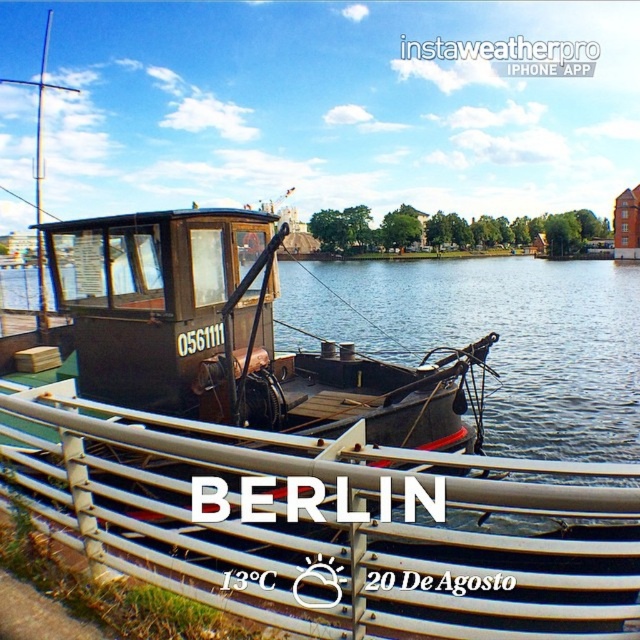
Question: Among these objects, which one is nearest to the camera?

Choices:
 (A) metal/rustic rail at lower center
 (B) rusty metal boat at center

Answer: (A)

Question: Which point appears closest to the camera in this image?

Choices:
 (A) (60, 396)
 (B) (120, 372)

Answer: (A)

Question: Is metal/rustic rail at lower center further to the viewer compared to rusty metal boat at center?

Choices:
 (A) yes
 (B) no

Answer: (B)

Question: From the image, what is the correct spatial relationship of metal/rustic rail at lower center in relation to rusty metal boat at center?

Choices:
 (A) left
 (B) right

Answer: (A)

Question: Can you confirm if metal/rustic rail at lower center is thinner than rusty metal boat at center?

Choices:
 (A) no
 (B) yes

Answer: (A)